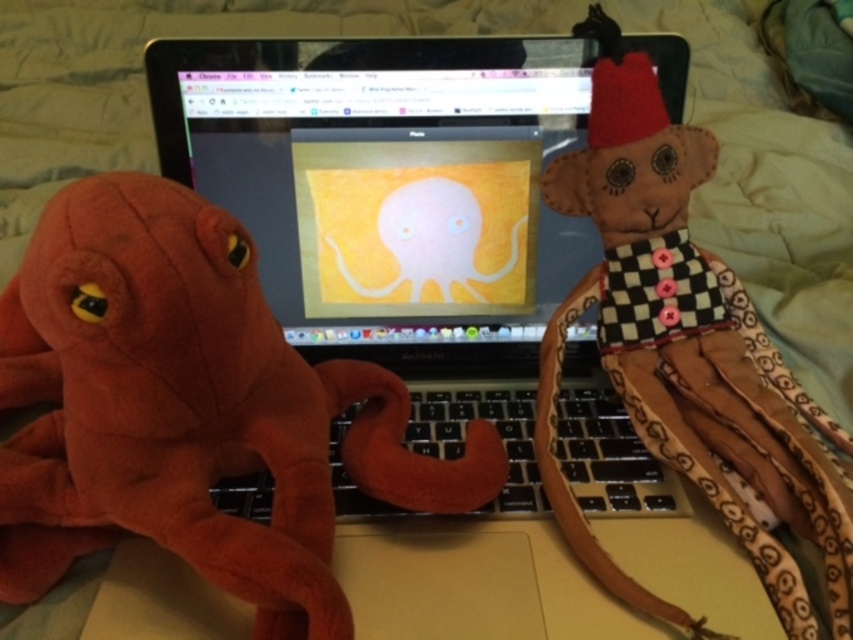
You are trying to place a new keyboard cover on the matte plastic laptop at center. The cover requires a 10 inch clearance on all sides. Can the soft plush octopus at left be moved to make enough space?

The soft plush octopus at left is only 8.04 inches away from the matte plastic laptop at center, so moving it would provide sufficient space to meet the 10 inch clearance requirement for the keyboard cover.

You are trying to place a new sticker on the laptop keyboard between the soft plush octopus at left and the mouse plush toy on the right. According to their positions, where should you place the sticker?

The soft plush octopus at left is located at point (189, 410). To place the sticker between them, you should position it halfway between these coordinates.